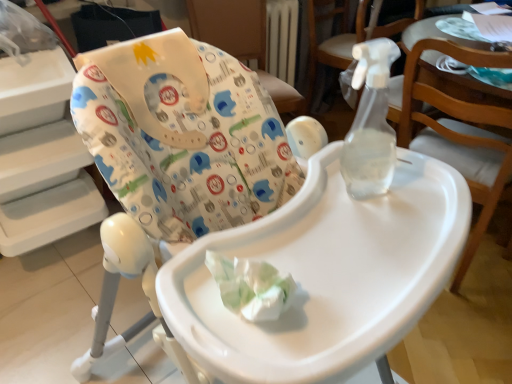
Question: Looking at their shapes, would you say transparent plastic spray bottle at upper right, the 2th chair positioned from the back, is wider or thinner than white fabric highchair at upper center, the 4th chair in the front-to-back sequence?

Choices:
 (A) wide
 (B) thin

Answer: (A)

Question: Does point (315, 56) appear closer or farther from the camera than point (209, 18)?

Choices:
 (A) farther
 (B) closer

Answer: (A)

Question: Which of these objects is positioned closest to the white fabric highchair at upper center, which is counted as the 1th chair, starting from the back?

Choices:
 (A) transparent plastic spray bottle at upper right, the third chair positioned from the back
 (B) white plastic highchair at center, the first chair when ordered from front to back
 (C) transparent plastic spray bottle at upper right, the 2th chair positioned from the back

Answer: (C)

Question: Which of these objects is positioned closest to the white plastic highchair at center, the first chair when ordered from front to back?

Choices:
 (A) transparent plastic spray bottle at upper right, the third chair from the front
 (B) transparent plastic spray bottle at upper right, the second chair positioned from the front
 (C) white fabric highchair at upper center, the 4th chair in the front-to-back sequence

Answer: (B)